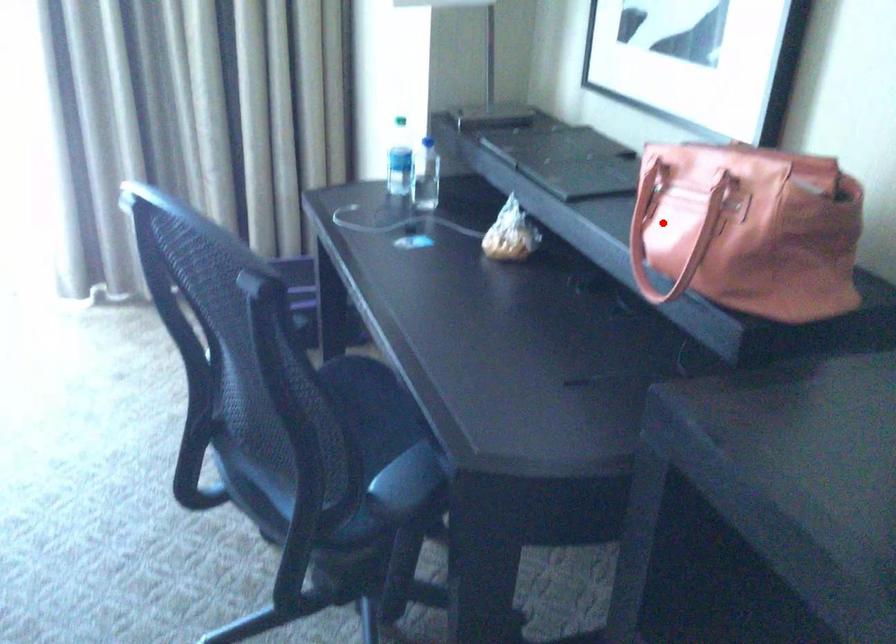
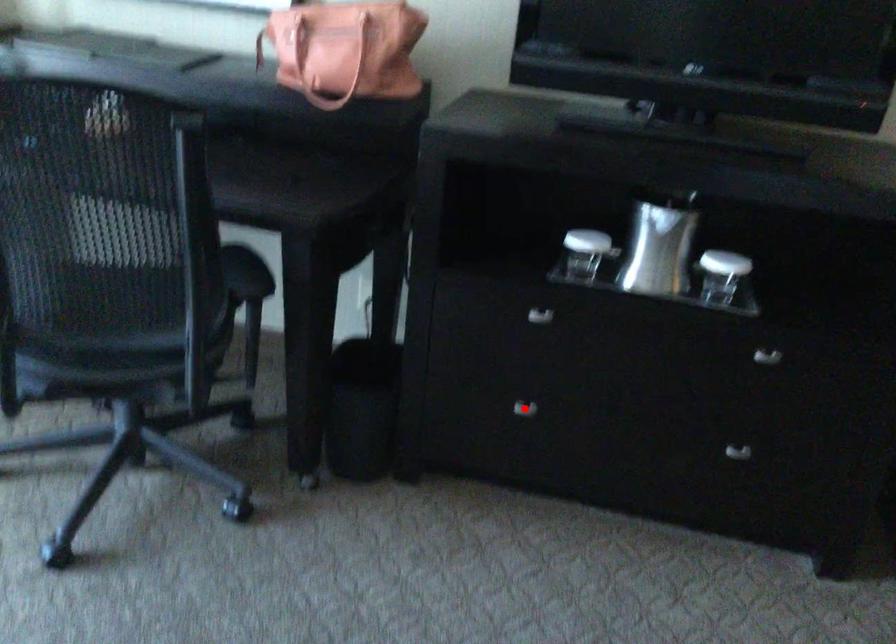
I am providing you with two images of the same scene from different viewpoints. A red point is marked on the first image and another point is marked on the second image. Do the highlighted points in image1 and image2 indicate the same real-world spot?

No